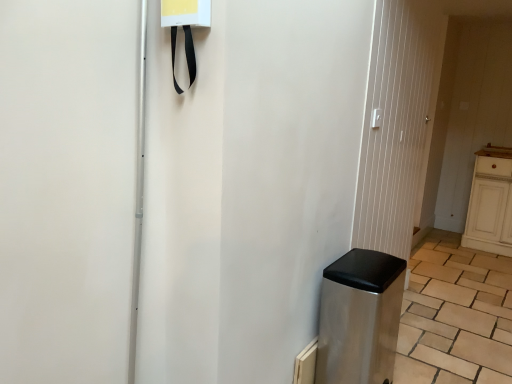
Question: Considering the relative sizes of brown wooden counter top at right and metallic silver screen door at center in the image provided, is brown wooden counter top at right thinner than metallic silver screen door at center?

Choices:
 (A) no
 (B) yes

Answer: (A)

Question: Considering the relative positions of brown wooden counter top at right and metallic silver screen door at center in the image provided, is brown wooden counter top at right to the right of metallic silver screen door at center from the viewer's perspective?

Choices:
 (A) yes
 (B) no

Answer: (A)

Question: Can you confirm if brown wooden counter top at right is wider than metallic silver screen door at center?

Choices:
 (A) yes
 (B) no

Answer: (A)

Question: Considering the relative positions of brown wooden counter top at right and metallic silver screen door at center in the image provided, is brown wooden counter top at right in front of metallic silver screen door at center?

Choices:
 (A) yes
 (B) no

Answer: (B)

Question: From a real-world perspective, is brown wooden counter top at right below metallic silver screen door at center?

Choices:
 (A) yes
 (B) no

Answer: (A)

Question: Does brown wooden counter top at right turn towards metallic silver screen door at center?

Choices:
 (A) yes
 (B) no

Answer: (A)

Question: Is brown wooden counter top at right further to the viewer compared to stainless steel trash can at lower right?

Choices:
 (A) no
 (B) yes

Answer: (B)

Question: Is brown wooden counter top at right positioned with its back to stainless steel trash can at lower right?

Choices:
 (A) yes
 (B) no

Answer: (B)

Question: Does brown wooden counter top at right appear on the left side of stainless steel trash can at lower right?

Choices:
 (A) yes
 (B) no

Answer: (B)

Question: Is brown wooden counter top at right with stainless steel trash can at lower right?

Choices:
 (A) no
 (B) yes

Answer: (A)

Question: Considering the relative sizes of brown wooden counter top at right and stainless steel trash can at lower right in the image provided, is brown wooden counter top at right thinner than stainless steel trash can at lower right?

Choices:
 (A) yes
 (B) no

Answer: (A)

Question: Can you confirm if brown wooden counter top at right is bigger than stainless steel trash can at lower right?

Choices:
 (A) yes
 (B) no

Answer: (B)

Question: Does stainless steel trash can at lower right have a lesser width compared to metallic silver screen door at center?

Choices:
 (A) yes
 (B) no

Answer: (B)